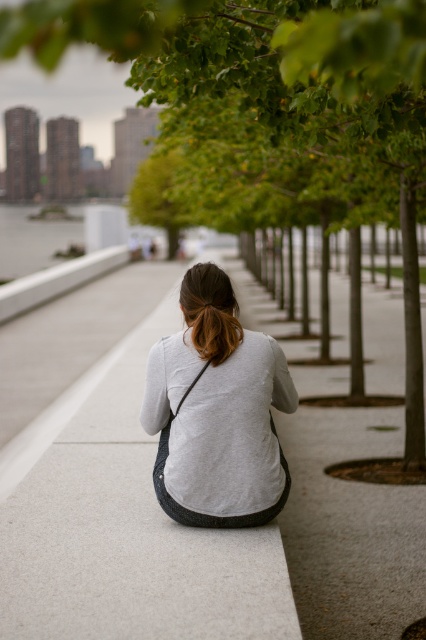
Which is more to the right, smooth concrete bench at center or green leafy tree at center?

smooth concrete bench at center is more to the right.

What do you see at coordinates (123, 525) in the screenshot?
I see `smooth concrete bench at center` at bounding box center [123, 525].

Is point (276, 544) positioned after point (268, 33)?

No, (276, 544) is closer to viewer.

You are a GUI agent. You are given a task and a screenshot of the screen. Output one action in this format:
    pyautogui.click(x=<x>, y=<y>)
    Task: Click on the smooth concrete bench at center
    Image resolution: width=426 pixels, height=640 pixels.
    Given the screenshot: What is the action you would take?
    pyautogui.click(x=123, y=525)

Between smooth concrete bench at center and white concrete curb at center, which one has more height?

With more height is white concrete curb at center.

Between point (186, 625) and point (34, 280), which one is positioned behind?

Point (34, 280)

Find the location of `smooth concrete bench at center`. smooth concrete bench at center is located at coordinates (123, 525).

Is white concrete curb at center smaller than golden brown hair at center?

No, white concrete curb at center is not smaller than golden brown hair at center.

Is white concrete curb at center positioned at the back of golden brown hair at center?

Yes.

You are a GUI agent. You are given a task and a screenshot of the screen. Output one action in this format:
    pyautogui.click(x=<x>, y=<y>)
    Task: Click on the white concrete curb at center
    
    Given the screenshot: What is the action you would take?
    pyautogui.click(x=57, y=280)